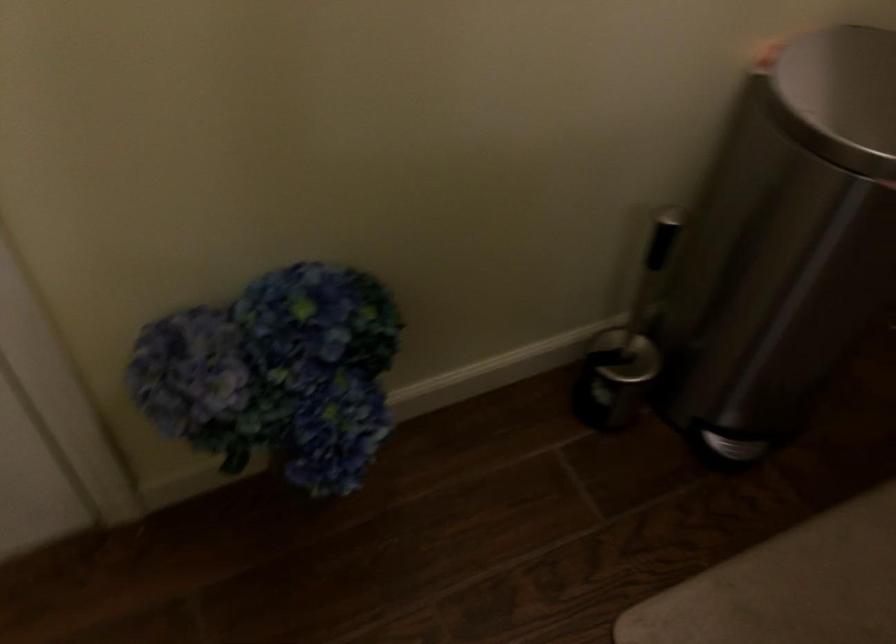
Where is `toilet brush handle`? toilet brush handle is located at coordinates pos(650,270).